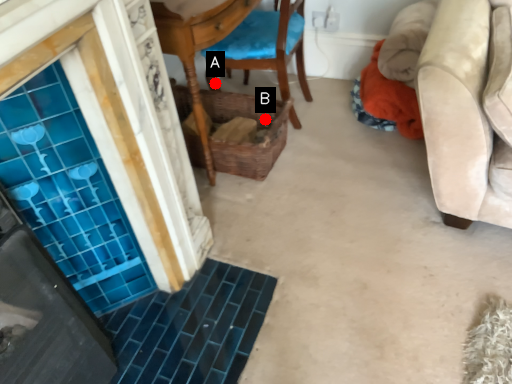
Question: Two points are circled on the image, labeled by A and B beside each circle. Which point is closer to the camera taking this photo?

Choices:
 (A) A is closer
 (B) B is closer

Answer: (B)